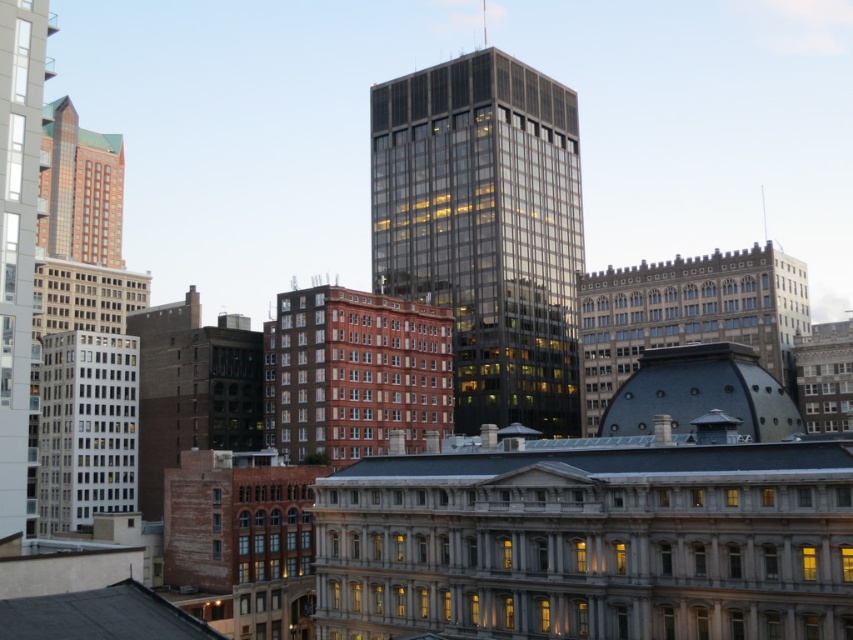
Question: Which point is closer to the camera taking this photo?

Choices:
 (A) (97, 388)
 (B) (242, 368)
 (C) (7, 516)

Answer: (C)

Question: Which of the following is the farthest from the observer?

Choices:
 (A) (500, 136)
 (B) (3, 160)
 (C) (120, 509)

Answer: (A)

Question: Does dark glass skyscraper at center lie in front of brown stone building at center?

Choices:
 (A) no
 (B) yes

Answer: (A)

Question: In this image, where is brown stone building at center located relative to white glass building at left?

Choices:
 (A) above
 (B) below

Answer: (A)

Question: Which object appears farthest from the camera in this image?

Choices:
 (A) brown stone building at center
 (B) brown brick building at center-left
 (C) matte glass skyscraper at left

Answer: (B)

Question: Does dark glass skyscraper at center have a larger size compared to white glass building at left?

Choices:
 (A) no
 (B) yes

Answer: (B)